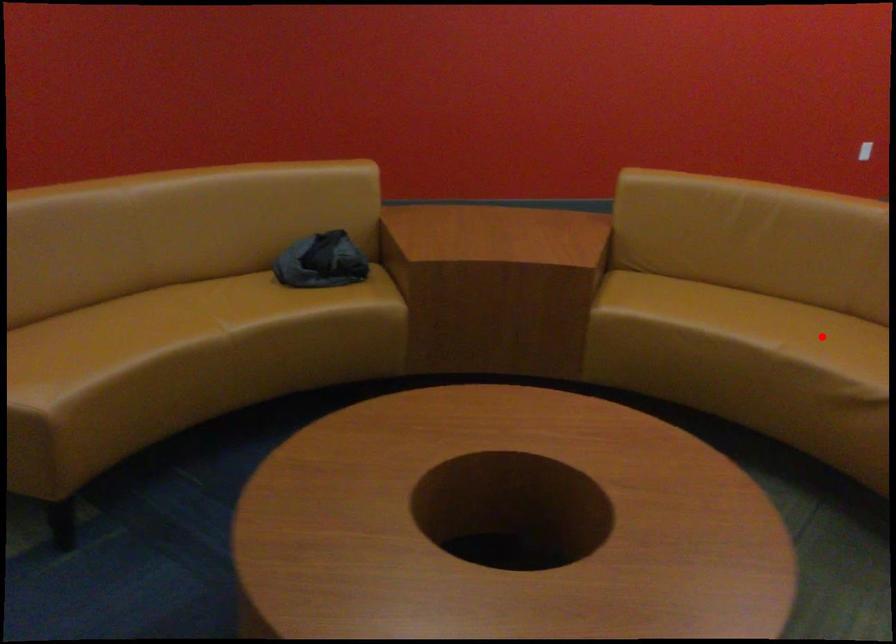
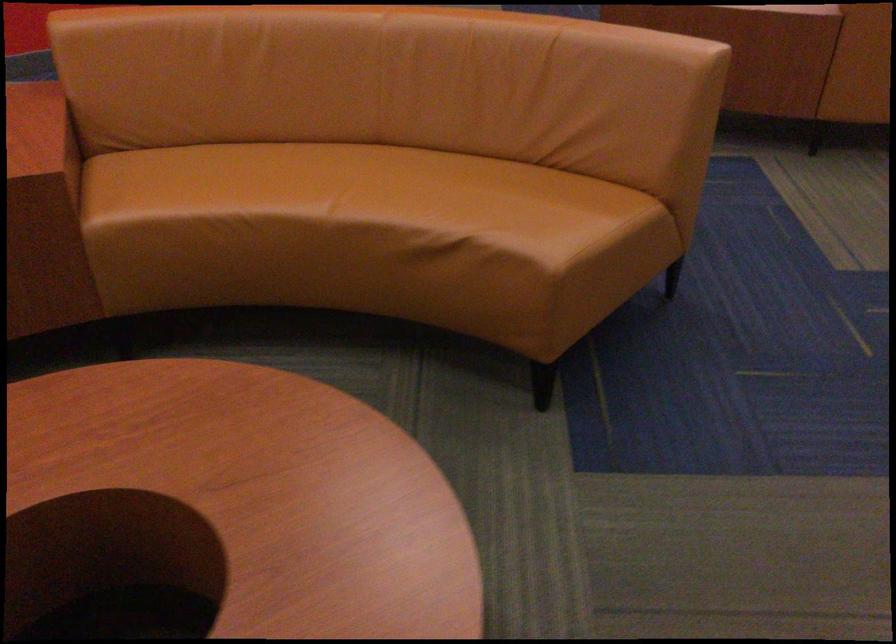
Locate, in the second image, the point that corresponds to the highlighted location in the first image.

(359, 189)